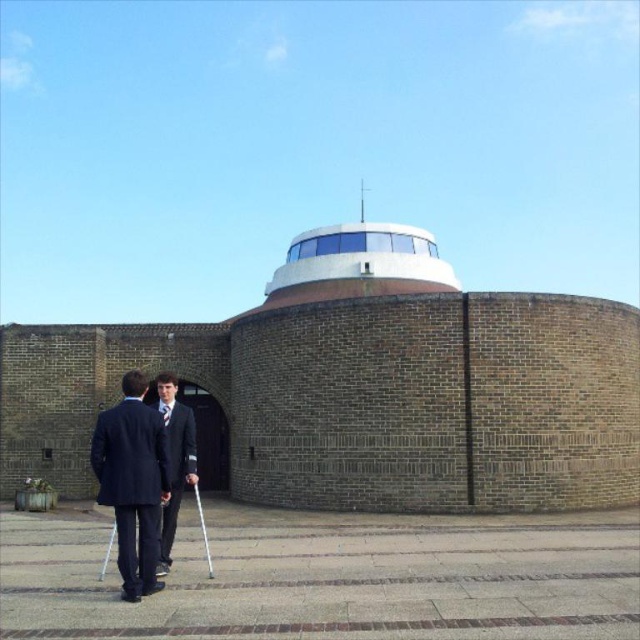
Question: Estimate the real-world distances between objects in this image. Which object is farther from the white smooth dome at center?

Choices:
 (A) dark blue suit at lower left
 (B) matte black suit at center

Answer: (A)

Question: Which of these objects is positioned closest to the matte black suit at center?

Choices:
 (A) dark blue suit at lower left
 (B) white smooth dome at center

Answer: (A)

Question: Which object is farther from the camera taking this photo?

Choices:
 (A) white smooth dome at center
 (B) matte black suit at center

Answer: (A)

Question: Can you confirm if white smooth dome at center is positioned below matte black suit at center?

Choices:
 (A) no
 (B) yes

Answer: (A)

Question: Is dark blue suit at lower left in front of white smooth dome at center?

Choices:
 (A) no
 (B) yes

Answer: (B)

Question: Is white smooth dome at center positioned behind matte black suit at center?

Choices:
 (A) yes
 (B) no

Answer: (A)